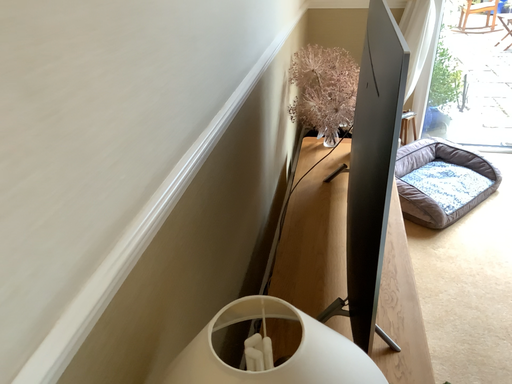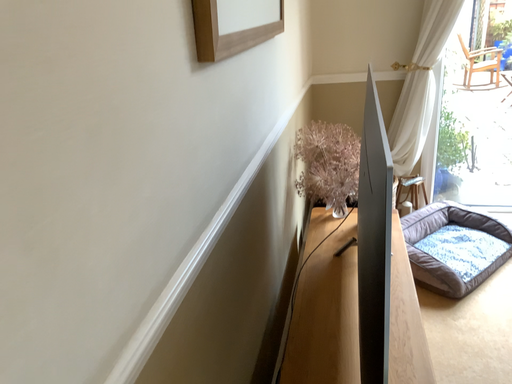
Question: How did the camera likely rotate when shooting the video?

Choices:
 (A) rotated downward
 (B) rotated upward

Answer: (B)